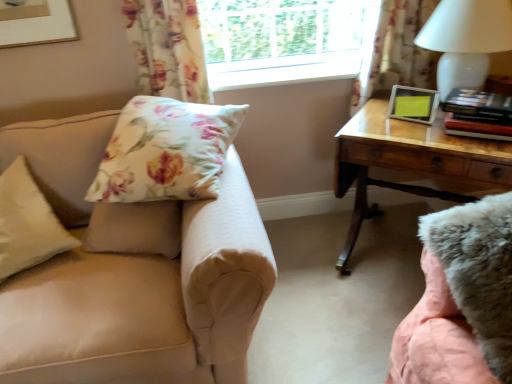
Where is `floral fabric pillow at upper left, the 1th pillow when ordered from right to left`? This screenshot has width=512, height=384. floral fabric pillow at upper left, the 1th pillow when ordered from right to left is located at coordinates (166, 151).

What is the approximate width of floral fabric curtain at upper right, which ranks as the 1th curtain in right-to-left order?

floral fabric curtain at upper right, which ranks as the 1th curtain in right-to-left order, is 15.74 centimeters in width.

Locate an element on the screen. This screenshot has width=512, height=384. yellow matte picture frame at upper right is located at coordinates point(413,104).

The image size is (512, 384). What are the coordinates of `beige fabric pillow at left, which appears as the 2th pillow when viewed from the right` in the screenshot? It's located at (27, 223).

From the image's perspective, between beige fabric pillow at left, arranged as the 1th pillow when viewed from the left, and transparent glass window at upper center, who is located below?

beige fabric pillow at left, arranged as the 1th pillow when viewed from the left, from the image's perspective.

Looking at their sizes, would you say beige fabric pillow at left, which appears as the 2th pillow when viewed from the right, is wider or thinner than transparent glass window at upper center?

beige fabric pillow at left, which appears as the 2th pillow when viewed from the right, is wider than transparent glass window at upper center.

Consider the image. From the image's perspective, which one is positioned lower, beige fabric pillow at left, which appears as the 2th pillow when viewed from the right, or floral fabric pillow at upper left, placed as the second pillow when sorted from left to right?

beige fabric pillow at left, which appears as the 2th pillow when viewed from the right.

Is beige fabric pillow at left, arranged as the 1th pillow when viewed from the left, not within floral fabric pillow at upper left, placed as the second pillow when sorted from left to right?

Indeed, beige fabric pillow at left, arranged as the 1th pillow when viewed from the left, is completely outside floral fabric pillow at upper left, placed as the second pillow when sorted from left to right.

Can you confirm if beige fabric pillow at left, arranged as the 1th pillow when viewed from the left, is positioned to the right of floral fabric pillow at upper left, placed as the second pillow when sorted from left to right?

In fact, beige fabric pillow at left, arranged as the 1th pillow when viewed from the left, is to the left of floral fabric pillow at upper left, placed as the second pillow when sorted from left to right.

Considering the sizes of objects beige fabric pillow at left, arranged as the 1th pillow when viewed from the left, and floral fabric pillow at upper left, the 1th pillow when ordered from right to left, in the image provided, who is thinner, beige fabric pillow at left, arranged as the 1th pillow when viewed from the left, or floral fabric pillow at upper left, the 1th pillow when ordered from right to left,?

Thinner between the two is floral fabric pillow at upper left, the 1th pillow when ordered from right to left.

Is floral fabric curtain at upper left, which is the second curtain from right to left, taller or shorter than fuzzy pink swivel chair at lower right?

In the image, floral fabric curtain at upper left, which is the second curtain from right to left, appears to be taller than fuzzy pink swivel chair at lower right.

Is floral fabric curtain at upper left, which is the second curtain from right to left, behind fuzzy pink swivel chair at lower right?

Yes, it is.

Is floral fabric curtain at upper left, marked as the first curtain in a left-to-right arrangement, aimed at fuzzy pink swivel chair at lower right?

No, floral fabric curtain at upper left, marked as the first curtain in a left-to-right arrangement, is not turned towards fuzzy pink swivel chair at lower right.

Considering the sizes of floral fabric curtain at upper left, marked as the first curtain in a left-to-right arrangement, and fuzzy pink swivel chair at lower right in the image, is floral fabric curtain at upper left, marked as the first curtain in a left-to-right arrangement, wider or thinner than fuzzy pink swivel chair at lower right?

Considering their sizes, floral fabric curtain at upper left, marked as the first curtain in a left-to-right arrangement, looks slimmer than fuzzy pink swivel chair at lower right.

Is white plastic window frame at upper center facing towards fuzzy pink swivel chair at lower right?

No, white plastic window frame at upper center is not oriented towards fuzzy pink swivel chair at lower right.

Looking at this image, which object is thinner, white plastic window frame at upper center or fuzzy pink swivel chair at lower right?

white plastic window frame at upper center is thinner.

Considering the points (225, 84) and (467, 290), which point is behind, point (225, 84) or point (467, 290)?

The point (225, 84) is behind.

Considering the positions of objects white plastic window frame at upper center and fuzzy pink swivel chair at lower right in the image provided, who is more to the left, white plastic window frame at upper center or fuzzy pink swivel chair at lower right?

white plastic window frame at upper center is more to the left.

At what (x,y) coordinates should I click in order to perform the action: click on window frame below the floral fabric curtain at upper right, which ranks as the 1th curtain in right-to-left order (from the image's perspective). Please return your answer as a coordinate pair (x, y). This screenshot has height=384, width=512. Looking at the image, I should click on (284, 70).

Can you tell me how much floral fabric curtain at upper right, the 2th curtain when ordered from left to right, and white plastic window frame at upper center differ in facing direction?

The facing directions of floral fabric curtain at upper right, the 2th curtain when ordered from left to right, and white plastic window frame at upper center are 0.00118 degrees apart.

From a real-world perspective, is floral fabric curtain at upper right, the 2th curtain when ordered from left to right, on top of white plastic window frame at upper center?

Yes, from a real-world perspective, floral fabric curtain at upper right, the 2th curtain when ordered from left to right, is above white plastic window frame at upper center.

Can you confirm if transparent glass window at upper center is thinner than beige fabric couch at left?

Indeed, transparent glass window at upper center has a lesser width compared to beige fabric couch at left.

Is beige fabric couch at left completely or partially inside transparent glass window at upper center?

That's incorrect, beige fabric couch at left is not inside transparent glass window at upper center.

Considering the points (302, 29) and (231, 265), which point is in front, point (302, 29) or point (231, 265)?

Positioned in front is point (231, 265).

From a real-world perspective, does transparent glass window at upper center stand above beige fabric couch at left?

Correct, in the physical world, transparent glass window at upper center is higher than beige fabric couch at left.

From a real-world perspective, is wooden desk at right located higher than transparent glass window at upper center?

No.

Which of these two, wooden desk at right or transparent glass window at upper center, is bigger?

wooden desk at right.

Between wooden desk at right and transparent glass window at upper center, which one is positioned behind?

transparent glass window at upper center is further from the camera.

Locate an element on the screen. This screenshot has height=384, width=512. window that is above the beige fabric pillow at left, arranged as the 1th pillow when viewed from the left (from a real-world perspective) is located at coordinates (284, 40).

This screenshot has width=512, height=384. In order to click on pillow lying on the left of floral fabric pillow at upper left, placed as the second pillow when sorted from left to right in this screenshot , I will do `click(27, 223)`.

Looking at this image, considering their positions, is beige fabric couch at left positioned closer to hardcover books at right than white plastic window frame at upper center?

white plastic window frame at upper center is positioned closer to the anchor hardcover books at right.

Considering their positions, is white plastic window frame at upper center positioned further to floral fabric curtain at upper left, which is the second curtain from right to left, than beige fabric couch at left?

beige fabric couch at left lies further to floral fabric curtain at upper left, which is the second curtain from right to left, than the other object.

From the image, which object appears to be nearer to floral fabric curtain at upper right, which ranks as the 1th curtain in right-to-left order, yellow matte picture frame at upper right or hardcover books at right?

The object closer to floral fabric curtain at upper right, which ranks as the 1th curtain in right-to-left order, is yellow matte picture frame at upper right.

When comparing their distances from beige fabric couch at left, does white glossy table lamp at upper right or floral fabric pillow at upper left, the 1th pillow when ordered from right to left, seem closer?

The object closer to beige fabric couch at left is floral fabric pillow at upper left, the 1th pillow when ordered from right to left.

When comparing their distances from floral fabric curtain at upper right, which ranks as the 1th curtain in right-to-left order, does transparent glass window at upper center or wooden desk at right seem further?

wooden desk at right lies further to floral fabric curtain at upper right, which ranks as the 1th curtain in right-to-left order, than the other object.

Based on their spatial positions, is fuzzy pink swivel chair at lower right or floral fabric pillow at upper left, the 1th pillow when ordered from right to left, closer to white glossy table lamp at upper right?

fuzzy pink swivel chair at lower right lies closer to white glossy table lamp at upper right than the other object.

Estimate the real-world distances between objects in this image. Which object is closer to beige fabric pillow at left, arranged as the 1th pillow when viewed from the left, transparent glass window at upper center or yellow matte picture frame at upper right?

Among the two, transparent glass window at upper center is located nearer to beige fabric pillow at left, arranged as the 1th pillow when viewed from the left.

In the scene shown: Based on their spatial positions, is beige fabric couch at left or floral fabric pillow at upper left, the 1th pillow when ordered from right to left, closer to floral fabric curtain at upper right, which ranks as the 1th curtain in right-to-left order?

floral fabric pillow at upper left, the 1th pillow when ordered from right to left.

Locate an element on the screen. The image size is (512, 384). picture frame situated between floral fabric pillow at upper left, placed as the second pillow when sorted from left to right, and hardcover books at right from left to right is located at coordinates (413, 104).

You are a GUI agent. You are given a task and a screenshot of the screen. Output one action in this format:
    pyautogui.click(x=<x>, y=<y>)
    Task: Click on the window frame located between floral fabric pillow at upper left, placed as the second pillow when sorted from left to right, and yellow matte picture frame at upper right in the left-right direction
    The height and width of the screenshot is (384, 512).
    Given the screenshot: What is the action you would take?
    pyautogui.click(x=284, y=70)

Find the location of a particular element. The height and width of the screenshot is (384, 512). window frame situated between transparent glass window at upper center and floral fabric curtain at upper right, the 2th curtain when ordered from left to right, from left to right is located at coordinates (284, 70).

The image size is (512, 384). I want to click on window between floral fabric pillow at upper left, the 1th pillow when ordered from right to left, and white plastic window frame at upper center in the front-back direction, so click(x=284, y=40).